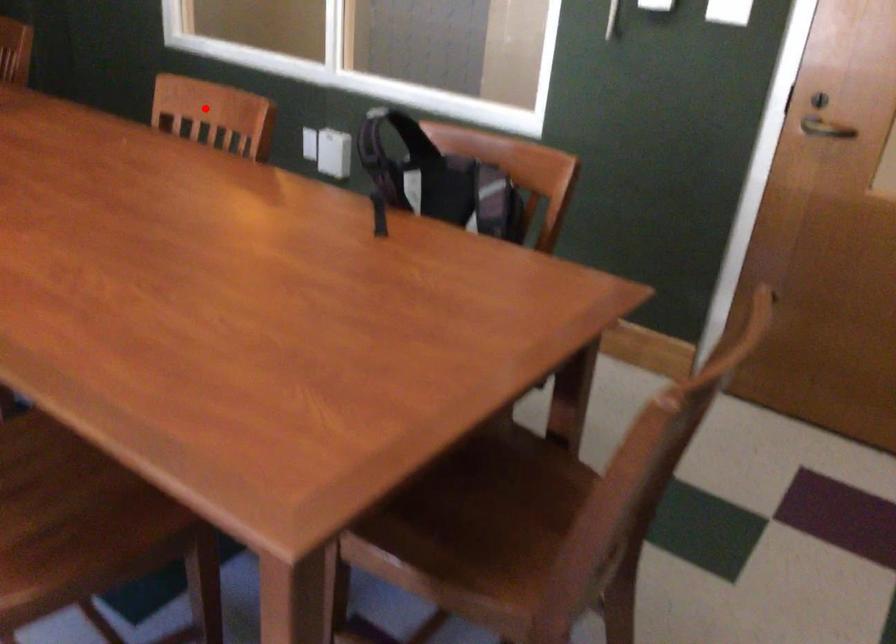
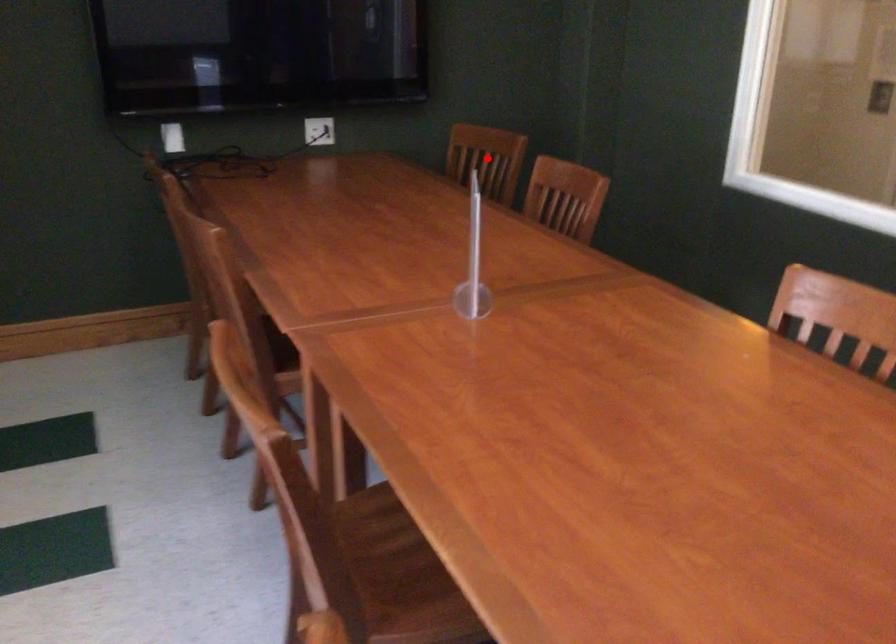
I am providing you with two images of the same scene from different viewpoints. A red point is marked on the first image and another point is marked on the second image. Is the red point in image1 aligned with the point shown in image2?

No